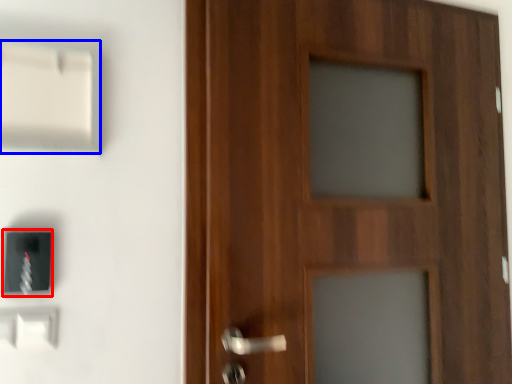
Question: Which object is further to the camera taking this photo, light switch (highlighted by a red box) or light switch (highlighted by a blue box)?

Choices:
 (A) light switch
 (B) light switch

Answer: (A)